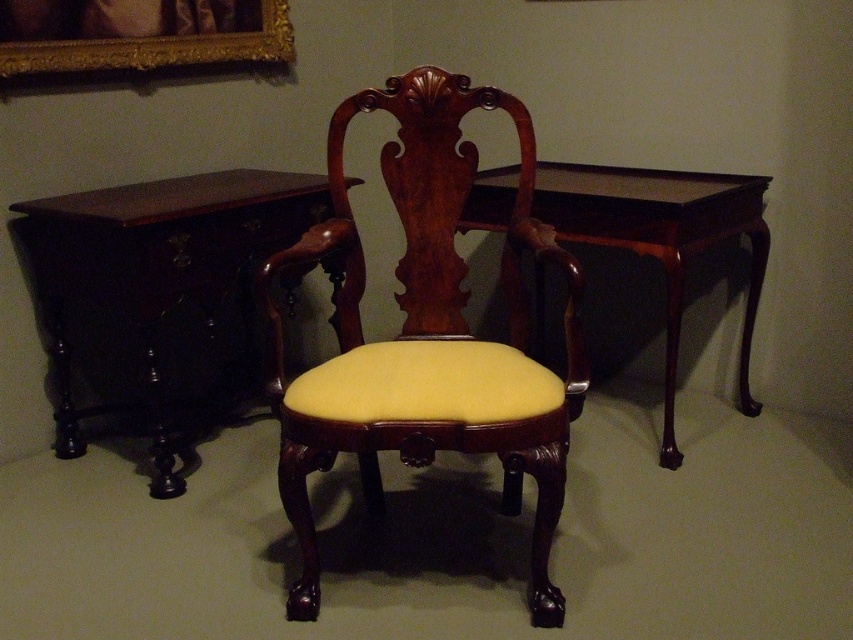
You are standing in front of the antique furniture display. You want to touch the mahogany wood armchair at center and the dark wood table at left. Which object will you reach first?

The mahogany wood armchair at center is closer to the viewer than the dark wood table at left, so you will reach the mahogany wood armchair at center first.

You are standing in front of the antique furniture display. There are two points marked on the image. The first point is at coordinates point (126, 294) and the second is at point (549, 209). Which point is closer to you?

Point (126, 294) is closer to the camera than point (549, 209).